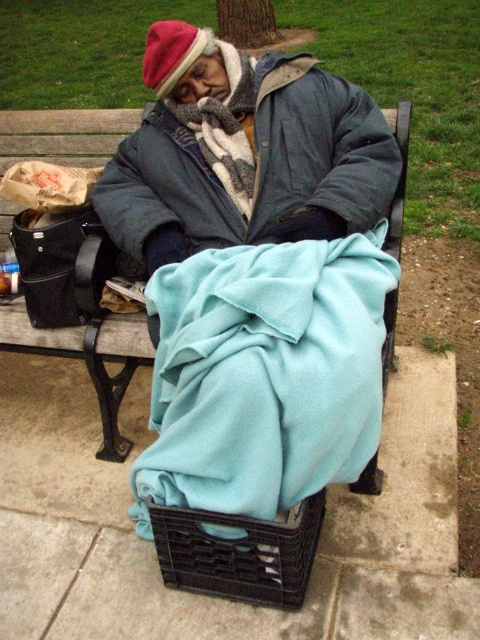
You are a park visitor who wants to sit on the wooden bench at center. There is a matte blue blanket at center already on it. Can you sit there without moving the blanket?

The matte blue blanket at center is in front of the wooden bench at center, so it is likely placed on the bench. If you sit there without moving it, the blanket would be between you and the bench, possibly making sitting uncomfortable. It is better to move the blanket or choose another spot.

You are standing in front of the park bench and want to place a small object on the bench. The coordinates of the two points where you can place it are point (x=188, y=362) and point (x=86, y=116). Which point is closer to you?

Point (x=188, y=362) is closer to the viewer than point (x=86, y=116).

You are a park visitor who wants to sit on the bench. There are two blankets on the bench. The teal fleece blanket at lower center and the matte blue blanket at center. Which blanket is taller?

The teal fleece blanket at lower center is taller than the matte blue blanket at center.